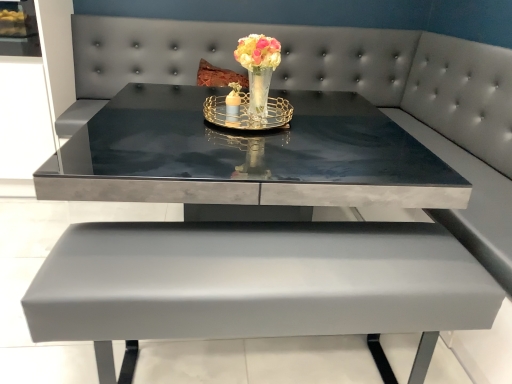
Find the location of `gold metallic tray at center`. gold metallic tray at center is located at coordinates (248, 113).

Does point (371, 119) come closer to viewer compared to point (263, 102)?

That is False.

From a real-world perspective, is glossy concrete table at center physically below glossy glass vase at center?

Yes.

From the image's perspective, relative to glossy glass vase at center, is glossy concrete table at center above or below?

glossy concrete table at center is situated lower than glossy glass vase at center in the image.

Is glossy concrete table at center facing towards glossy glass vase at center?

No, glossy concrete table at center does not turn towards glossy glass vase at center.

From a real-world perspective, who is located higher, glossy concrete table at center or gold metallic tray at center?

gold metallic tray at center is physically above.

Can you tell me how much glossy concrete table at center and gold metallic tray at center differ in facing direction?

The facing directions of glossy concrete table at center and gold metallic tray at center are 3.62 degrees apart.

Is glossy concrete table at center smaller than gold metallic tray at center?

No.

Is point (262, 52) positioned in front of point (161, 225)?

No, it is behind (161, 225).

From the image's perspective, is glossy glass vase at center located beneath glossy concrete table at center?

No, from the image's perspective, glossy glass vase at center is not beneath glossy concrete table at center.

Can you confirm if glossy glass vase at center is taller than glossy concrete table at center?

No, glossy glass vase at center is not taller than glossy concrete table at center.

Considering the sizes of objects glossy glass vase at center and glossy concrete table at center in the image provided, who is thinner, glossy glass vase at center or glossy concrete table at center?

With smaller width is glossy glass vase at center.

Looking at this image, is glossy glass vase at center to the left of gold metallic tray at center from the viewer's perspective?

No.

Which of these two, glossy glass vase at center or gold metallic tray at center, stands shorter?

gold metallic tray at center.

From a real-world perspective, is glossy glass vase at center below gold metallic tray at center?

No.

From the image's perspective, who appears lower, glossy glass vase at center or gold metallic tray at center?

gold metallic tray at center appears lower in the image.

Is gold metallic tray at center aimed at glossy concrete table at center?

No.

From the image's perspective, is gold metallic tray at center above or below glossy concrete table at center?

Clearly, from the image's perspective, gold metallic tray at center is above glossy concrete table at center.

Between gold metallic tray at center and glossy concrete table at center, which one appears on the right side from the viewer's perspective?

glossy concrete table at center.

You are a GUI agent. You are given a task and a screenshot of the screen. Output one action in this format:
    pyautogui.click(x=<x>, y=<y>)
    Task: Click on the table on the right of gold metallic tray at center
    The width and height of the screenshot is (512, 384).
    Given the screenshot: What is the action you would take?
    pyautogui.click(x=257, y=282)

Is gold metallic tray at center positioned with its back to glossy glass vase at center?

Yes, gold metallic tray at center is positioned with its back facing glossy glass vase at center.

Is gold metallic tray at center to the left or to the right of glossy glass vase at center in the image?

In the image, gold metallic tray at center appears on the left side of glossy glass vase at center.

From the image's perspective, is gold metallic tray at center positioned above or below glossy glass vase at center?

gold metallic tray at center is below glossy glass vase at center.

The image size is (512, 384). I want to click on candle holder behind the glossy glass vase at center, so click(x=248, y=113).

The width and height of the screenshot is (512, 384). Find the location of `table in front of the glossy glass vase at center`. table in front of the glossy glass vase at center is located at coordinates (257, 282).

What are the coordinates of `candle holder on the left of glossy concrete table at center` in the screenshot? It's located at (248, 113).

When comparing their distances from gold metallic tray at center, does glossy glass vase at center or glossy concrete table at center seem further?

glossy concrete table at center is positioned further to the anchor gold metallic tray at center.

When comparing their distances from glossy glass vase at center, does gold metallic tray at center or glossy concrete table at center seem further?

Based on the image, glossy concrete table at center appears to be further to glossy glass vase at center.

Based on their spatial positions, is gold metallic tray at center or glossy glass vase at center closer to glossy concrete table at center?

gold metallic tray at center is closer to glossy concrete table at center.

Looking at the image, which one is located closer to gold metallic tray at center, glossy concrete table at center or glossy glass vase at center?

Based on the image, glossy glass vase at center appears to be nearer to gold metallic tray at center.

From the image, which object appears to be nearer to glossy concrete table at center, glossy glass vase at center or gold metallic tray at center?

gold metallic tray at center.

Based on their spatial positions, is glossy concrete table at center or gold metallic tray at center closer to glossy glass vase at center?

gold metallic tray at center lies closer to glossy glass vase at center than the other object.

The image size is (512, 384). What are the coordinates of `candle holder between glossy glass vase at center and glossy concrete table at center vertically` in the screenshot? It's located at (248, 113).